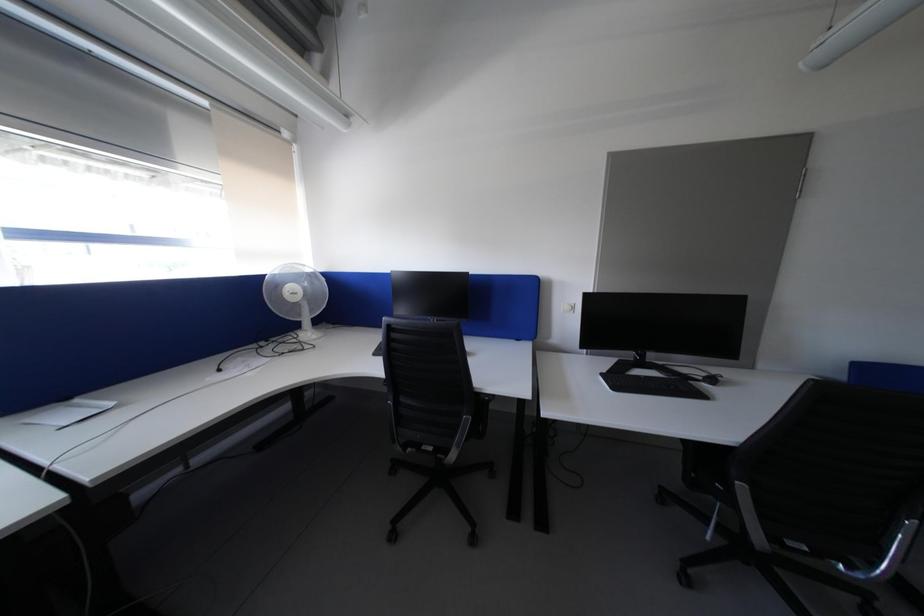
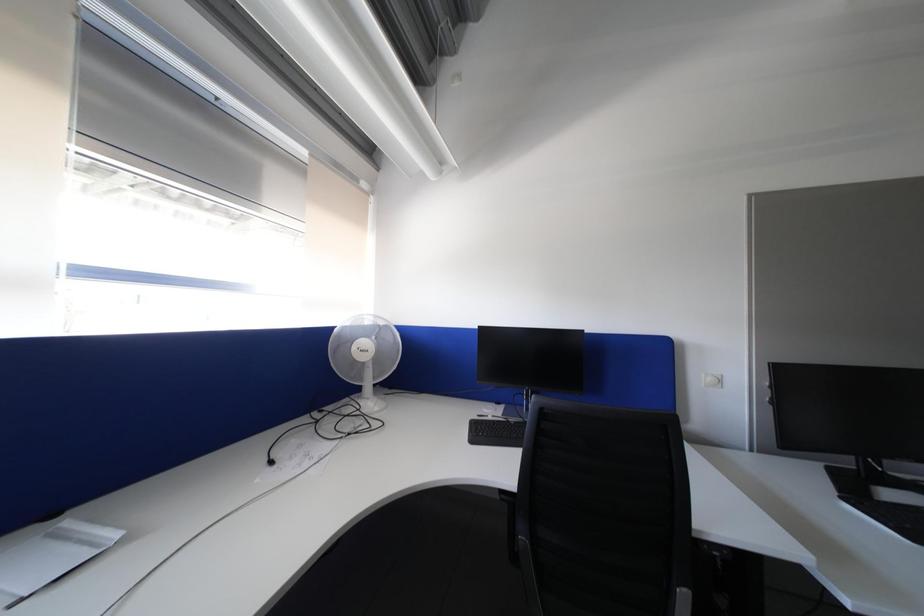
In a continuous first-person perspective shot, in which direction is the camera moving?

The cameraman walked toward left, forward.